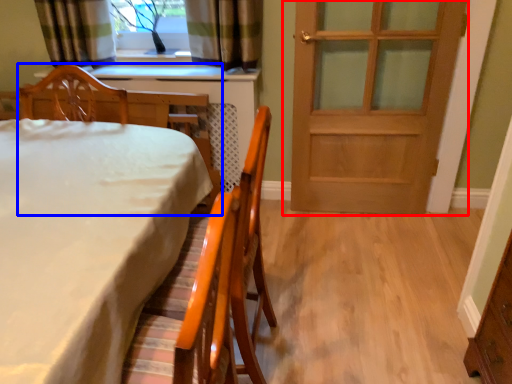
Question: Which object is further to the camera taking this photo, door (highlighted by a red box) or chair (highlighted by a blue box)?

Choices:
 (A) door
 (B) chair

Answer: (A)